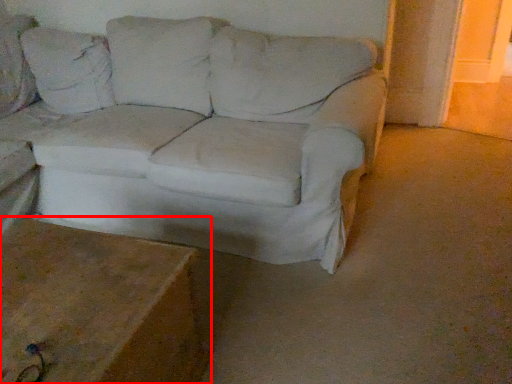
Question: From the image's perspective, what is the correct spatial relationship of table (annotated by the red box) in relation to studio couch?

Choices:
 (A) below
 (B) above

Answer: (A)